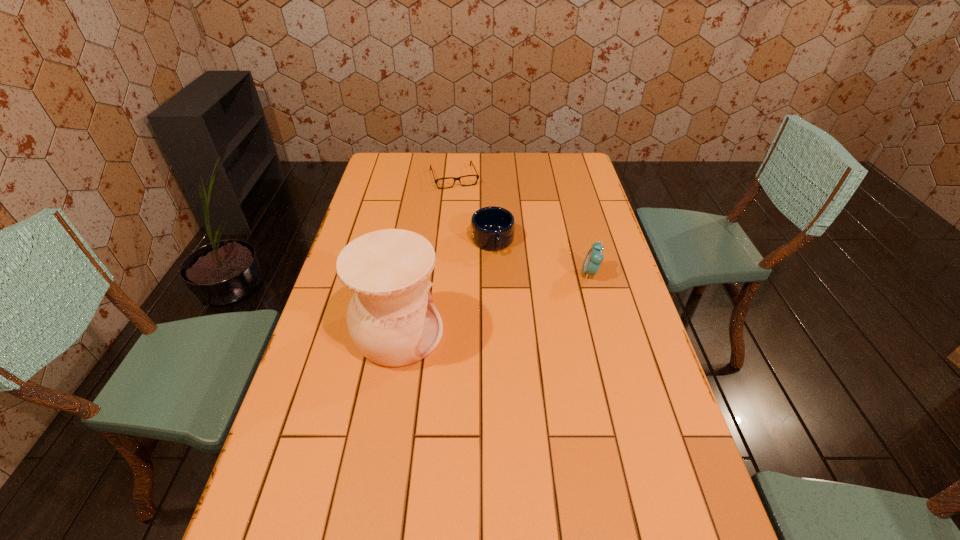
I want to click on free space on the desktop that is between the pottery and the second tallest object and is positioned with the handle on the side of the second shortest object, so click(510, 299).

The height and width of the screenshot is (540, 960). Find the location of `free space on the desktop that is between the nearest object and the third shortest object and is positioned on the front-facing side of the spectacles`. free space on the desktop that is between the nearest object and the third shortest object and is positioned on the front-facing side of the spectacles is located at coordinates (498, 302).